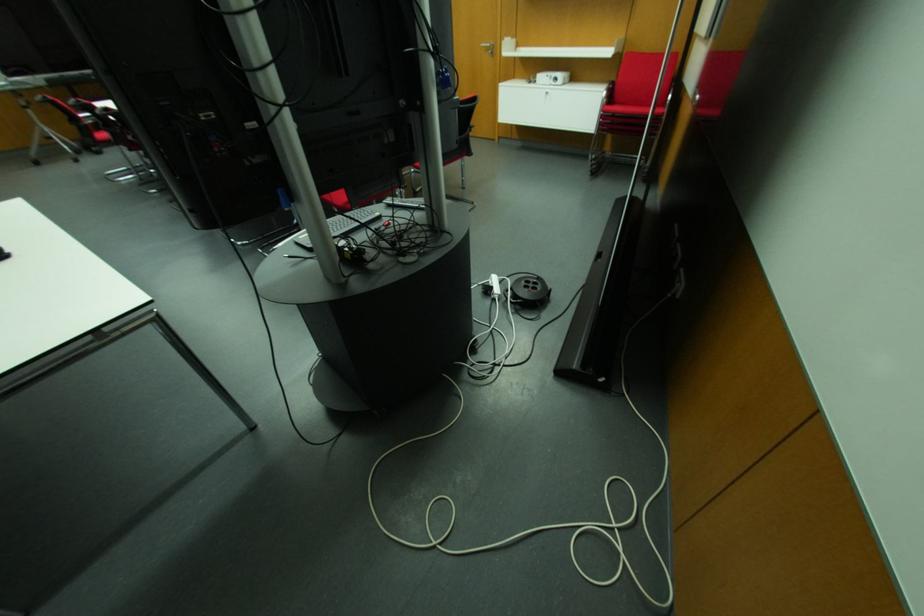
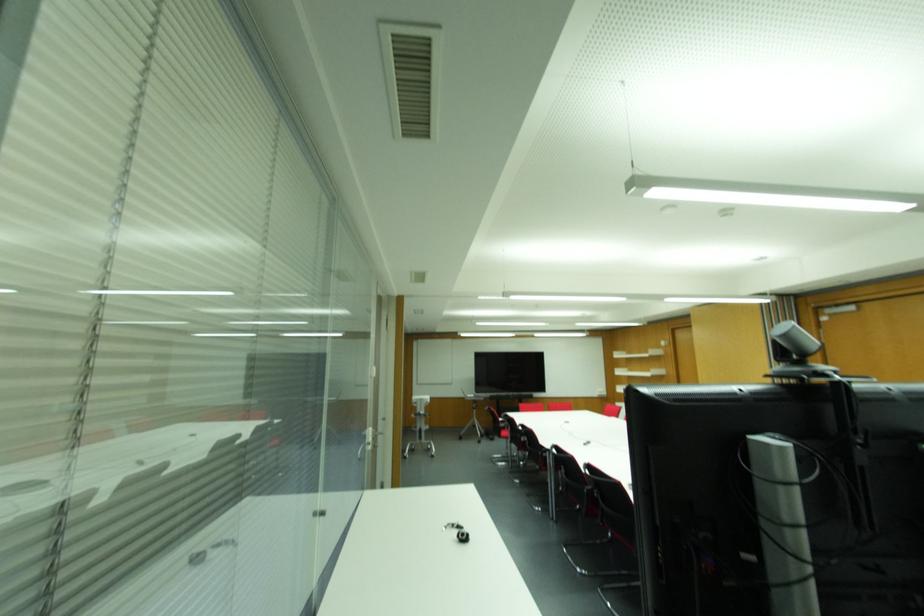
Based on the continuous images, in which direction is the camera rotating?

The rotation direction of the camera is left-up.